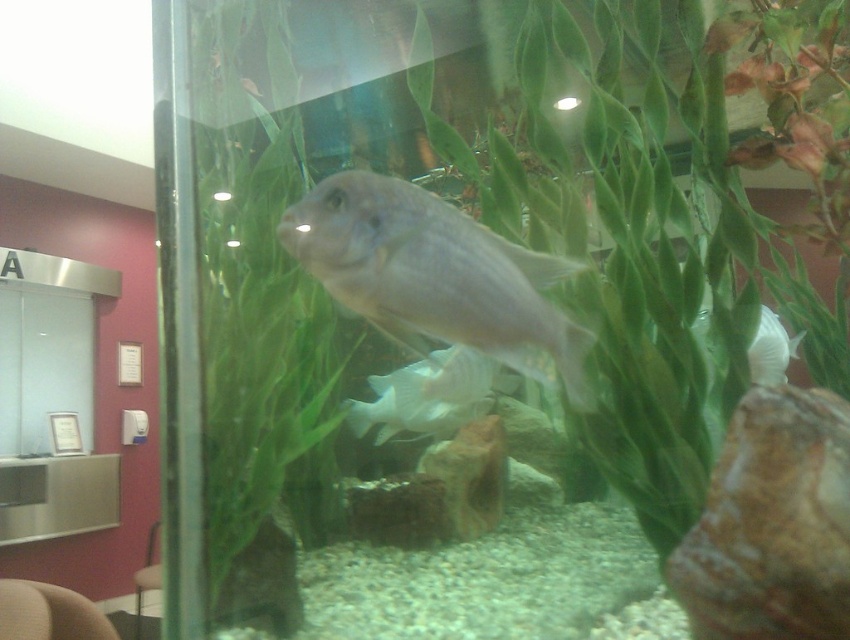
Image resolution: width=850 pixels, height=640 pixels. Describe the element at coordinates (435, 275) in the screenshot. I see `matte gray fish at center` at that location.

Based on the photo, can you confirm if matte gray fish at center is taller than white matte shell at center?

Indeed, matte gray fish at center has a greater height compared to white matte shell at center.

Who is more distant from viewer, (x=360, y=250) or (x=785, y=381)?

Positioned behind is point (x=785, y=381).

Locate an element on the screen. The height and width of the screenshot is (640, 850). matte gray fish at center is located at coordinates (435, 275).

Is matte gray fish at center to the right of white matte fish at center from the viewer's perspective?

Correct, you'll find matte gray fish at center to the right of white matte fish at center.

Looking at this image, can you confirm if matte gray fish at center is positioned above white matte fish at center?

Indeed, matte gray fish at center is positioned over white matte fish at center.

What do you see at coordinates (435, 275) in the screenshot? I see `matte gray fish at center` at bounding box center [435, 275].

Where is `matte gray fish at center`? matte gray fish at center is located at coordinates (435, 275).

Looking at this image, between white matte fish at center and white matte shell at center, which one is positioned higher?

white matte shell at center

In the scene shown: Is white matte fish at center thinner than white matte shell at center?

In fact, white matte fish at center might be wider than white matte shell at center.

You are a GUI agent. You are given a task and a screenshot of the screen. Output one action in this format:
    pyautogui.click(x=<x>, y=<y>)
    Task: Click on the white matte fish at center
    
    Given the screenshot: What is the action you would take?
    pyautogui.click(x=429, y=394)

I want to click on white matte fish at center, so click(429, 394).